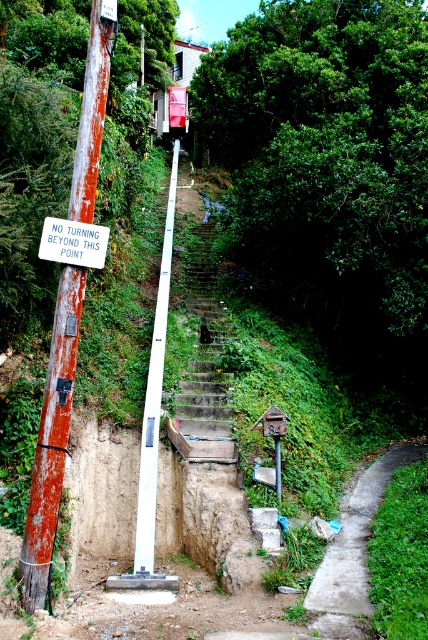
Question: Which of the following is the farthest from the observer?

Choices:
 (A) rusty metal pole at left
 (B) white plastic pole at center
 (C) concrete path at lower right
 (D) white plastic sign at upper left

Answer: (B)

Question: Is white plastic pole at center behind white plastic sign at upper left?

Choices:
 (A) no
 (B) yes

Answer: (B)

Question: Does white plastic pole at center have a smaller size compared to white plastic sign at upper left?

Choices:
 (A) no
 (B) yes

Answer: (A)

Question: Is rusty metal pole at left to the left of green mossy stairs at center from the viewer's perspective?

Choices:
 (A) no
 (B) yes

Answer: (B)

Question: Among these points, which one is nearest to the camera?

Choices:
 (A) (45, 250)
 (B) (33, 556)

Answer: (B)

Question: Based on their relative distances, which object is nearer to the concrete path at lower right?

Choices:
 (A) green mossy stairs at center
 (B) rusty metal pole at left
 (C) white plastic pole at center

Answer: (A)